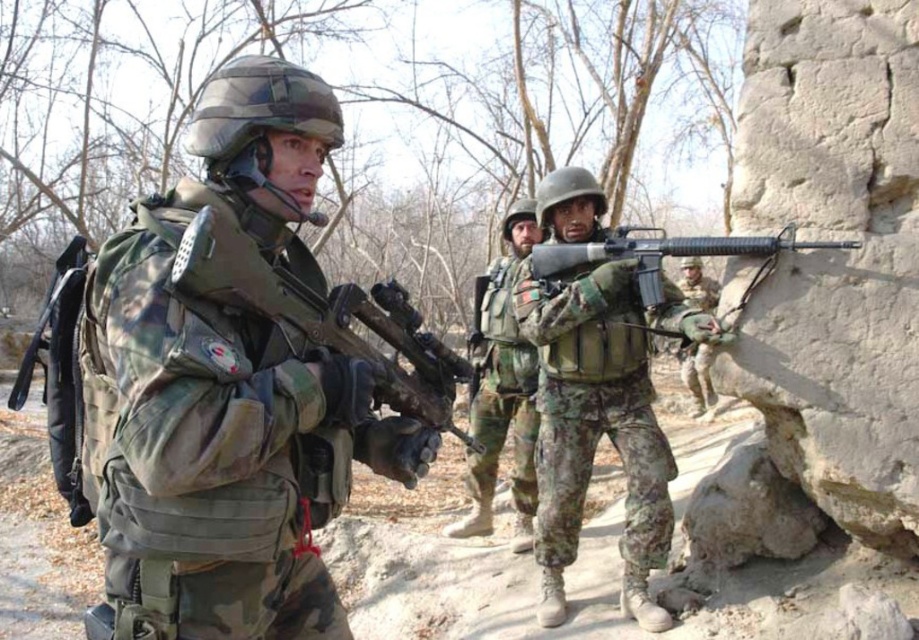
Between point (224, 216) and point (506, 380), which one is positioned in front?

Point (224, 216) is more forward.

Which is below, camo uniform at center or camouflage fabric helmet at center?

camouflage fabric helmet at center

Does point (213, 104) come behind point (520, 508)?

No, (213, 104) is closer to viewer.

Where is `camo uniform at center`? The height and width of the screenshot is (640, 919). camo uniform at center is located at coordinates (227, 385).

Does camo uniform at center appear on the left side of camouflage fabric rifle at center?

Indeed, camo uniform at center is positioned on the left side of camouflage fabric rifle at center.

Is point (244, 488) in front of point (547, 525)?

Yes, it is.

Is point (257, 579) positioned before point (549, 557)?

Yes, point (257, 579) is closer to viewer.

Image resolution: width=919 pixels, height=640 pixels. I want to click on camo uniform at center, so click(227, 385).

Is camouflage fabric helmet at center above matte black rifle at center?

Incorrect, camouflage fabric helmet at center is not positioned above matte black rifle at center.

Who is more distant from viewer, (481, 532) or (651, 276)?

The point (481, 532) is behind.

Who is more forward, (461, 524) or (608, 243)?

Point (608, 243) is more forward.

This screenshot has height=640, width=919. In order to click on camouflage fabric helmet at center in this screenshot , I will do `click(502, 387)`.